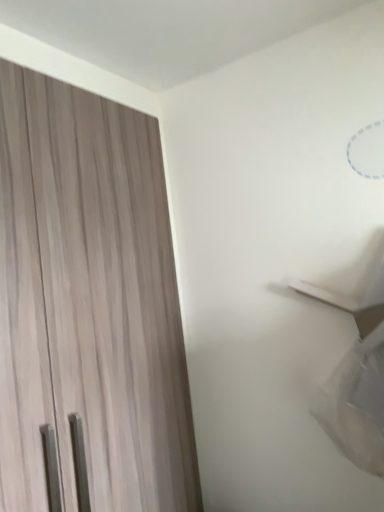
What do you see at coordinates (88, 305) in the screenshot?
I see `matte wood door at left` at bounding box center [88, 305].

Locate an element on the screen. matte wood door at left is located at coordinates (88, 305).

Where is `matte wood door at left`? The width and height of the screenshot is (384, 512). matte wood door at left is located at coordinates (88, 305).